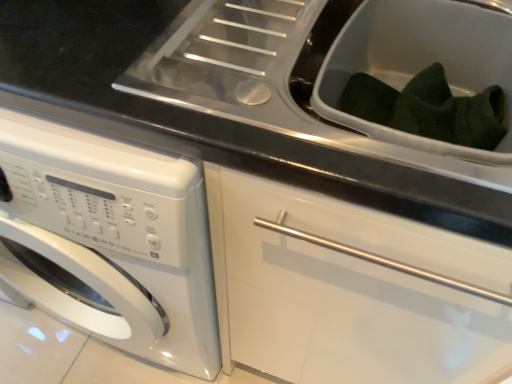
I want to click on dark green fabric at upper right, which is the first sink from back to front, so click(422, 62).

Where is `white plastic sink at center, acting as the 1th sink starting from the front`? white plastic sink at center, acting as the 1th sink starting from the front is located at coordinates (276, 84).

Between white plastic sink at center, acting as the 1th sink starting from the front, and dark green fabric at upper right, which is the second sink in front-to-back order, which one appears on the left side from the viewer's perspective?

white plastic sink at center, acting as the 1th sink starting from the front, is more to the left.

Is white plastic sink at center, marked as the second sink in a back-to-front arrangement, oriented away from dark green fabric at upper right, which is the second sink in front-to-back order?

Absolutely, white plastic sink at center, marked as the second sink in a back-to-front arrangement, is directed away from dark green fabric at upper right, which is the second sink in front-to-back order.

In the scene shown: Considering the sizes of objects white plastic sink at center, marked as the second sink in a back-to-front arrangement, and dark green fabric at upper right, which is the second sink in front-to-back order, in the image provided, who is thinner, white plastic sink at center, marked as the second sink in a back-to-front arrangement, or dark green fabric at upper right, which is the second sink in front-to-back order,?

Thinner between the two is dark green fabric at upper right, which is the second sink in front-to-back order.

Is the position of white plastic sink at center, marked as the second sink in a back-to-front arrangement, less distant than that of dark green fabric at upper right, which is the first sink from back to front?

Yes, it is in front of dark green fabric at upper right, which is the first sink from back to front.

Is white glossy washing machine at left at the back of dark green fabric at upper right, which is the first sink from back to front?

No, dark green fabric at upper right, which is the first sink from back to front,'s orientation is not away from white glossy washing machine at left.

In order to click on washing machine below the dark green fabric at upper right, which is the second sink in front-to-back order (from a real-world perspective) in this screenshot , I will do `click(109, 241)`.

From the image's perspective, does dark green fabric at upper right, which is the first sink from back to front, appear lower than white glossy washing machine at left?

Actually, dark green fabric at upper right, which is the first sink from back to front, appears above white glossy washing machine at left in the image.

Is dark green fabric at upper right, which is the second sink in front-to-back order, smaller than white glossy washing machine at left?

Yes.

Considering the sizes of objects white glossy washing machine at left and white plastic sink at center, marked as the second sink in a back-to-front arrangement, in the image provided, who is smaller, white glossy washing machine at left or white plastic sink at center, marked as the second sink in a back-to-front arrangement,?

Smaller between the two is white plastic sink at center, marked as the second sink in a back-to-front arrangement.

From the image's perspective, which is above, white glossy washing machine at left or white plastic sink at center, acting as the 1th sink starting from the front?

white plastic sink at center, acting as the 1th sink starting from the front, appears higher in the image.

Between white glossy washing machine at left and white plastic sink at center, marked as the second sink in a back-to-front arrangement, which one appears on the left side from the viewer's perspective?

white glossy washing machine at left is more to the left.

Between point (110, 252) and point (376, 155), which one is positioned behind?

The point (110, 252) is farther.

How different are the orientations of dark green fabric at upper right, which is the first sink from back to front, and white plastic sink at center, acting as the 1th sink starting from the front, in degrees?

The facing directions of dark green fabric at upper right, which is the first sink from back to front, and white plastic sink at center, acting as the 1th sink starting from the front, are 0.639 degrees apart.

Does dark green fabric at upper right, which is the second sink in front-to-back order, have a lesser height compared to white plastic sink at center, marked as the second sink in a back-to-front arrangement?

Yes.

From the image's perspective, relative to white plastic sink at center, acting as the 1th sink starting from the front, is dark green fabric at upper right, which is the first sink from back to front, above or below?

dark green fabric at upper right, which is the first sink from back to front, is below white plastic sink at center, acting as the 1th sink starting from the front.

From a real-world perspective, is dark green fabric at upper right, which is the first sink from back to front, on top of white plastic sink at center, acting as the 1th sink starting from the front?

No, from a real-world perspective, dark green fabric at upper right, which is the first sink from back to front, is not over white plastic sink at center, acting as the 1th sink starting from the front

Is white glossy washing machine at left spatially inside dark green fabric at upper right, which is the second sink in front-to-back order, or outside of it?

white glossy washing machine at left cannot be found inside dark green fabric at upper right, which is the second sink in front-to-back order.

Considering the positions of objects white glossy washing machine at left and dark green fabric at upper right, which is the first sink from back to front, in the image provided, who is more to the right, white glossy washing machine at left or dark green fabric at upper right, which is the first sink from back to front,?

Positioned to the right is dark green fabric at upper right, which is the first sink from back to front.

Does point (51, 147) appear closer or farther from the camera than point (474, 42)?

Point (51, 147) is closer to the camera than point (474, 42).

Can you tell me how much white glossy washing machine at left and dark green fabric at upper right, which is the second sink in front-to-back order, differ in facing direction?

white glossy washing machine at left and dark green fabric at upper right, which is the second sink in front-to-back order, are facing 2.2 degrees away from each other.

Considering the points (483, 182) and (203, 301), which point is in front, point (483, 182) or point (203, 301)?

Positioned in front is point (483, 182).

Is white glossy washing machine at left a part of white plastic sink at center, marked as the second sink in a back-to-front arrangement?

Actually, white glossy washing machine at left is outside white plastic sink at center, marked as the second sink in a back-to-front arrangement.

Consider the image. Is white plastic sink at center, acting as the 1th sink starting from the front, to the left of white glossy washing machine at left from the viewer's perspective?

No.

Does white plastic sink at center, acting as the 1th sink starting from the front, have a greater height compared to white glossy washing machine at left?

No, white plastic sink at center, acting as the 1th sink starting from the front, is not taller than white glossy washing machine at left.

Identify the location of sink behind the white plastic sink at center, acting as the 1th sink starting from the front. [422, 62].

Find the location of a particular element. The image size is (512, 384). washing machine below the dark green fabric at upper right, which is the second sink in front-to-back order (from a real-world perspective) is located at coordinates (109, 241).

Consider the image. Which object lies nearer to the anchor point white glossy washing machine at left, white plastic sink at center, marked as the second sink in a back-to-front arrangement, or dark green fabric at upper right, which is the first sink from back to front?

white plastic sink at center, marked as the second sink in a back-to-front arrangement, is positioned closer to the anchor white glossy washing machine at left.

Which object lies nearer to the anchor point white plastic sink at center, acting as the 1th sink starting from the front, dark green fabric at upper right, which is the second sink in front-to-back order, or white glossy washing machine at left?

Based on the image, dark green fabric at upper right, which is the second sink in front-to-back order, appears to be nearer to white plastic sink at center, acting as the 1th sink starting from the front.

Considering their positions, is white glossy washing machine at left positioned closer to white plastic sink at center, acting as the 1th sink starting from the front, than dark green fabric at upper right, which is the second sink in front-to-back order?

dark green fabric at upper right, which is the second sink in front-to-back order, is positioned closer to the anchor white plastic sink at center, acting as the 1th sink starting from the front.

Based on their spatial positions, is white plastic sink at center, marked as the second sink in a back-to-front arrangement, or white glossy washing machine at left closer to dark green fabric at upper right, which is the first sink from back to front?

The object closer to dark green fabric at upper right, which is the first sink from back to front, is white plastic sink at center, marked as the second sink in a back-to-front arrangement.

Looking at this image, based on their spatial positions, is white glossy washing machine at left or white plastic sink at center, acting as the 1th sink starting from the front, closer to dark green fabric at upper right, which is the first sink from back to front?

Based on the image, white plastic sink at center, acting as the 1th sink starting from the front, appears to be nearer to dark green fabric at upper right, which is the first sink from back to front.

When comparing their distances from white glossy washing machine at left, does dark green fabric at upper right, which is the first sink from back to front, or white plastic sink at center, acting as the 1th sink starting from the front, seem closer?

Based on the image, white plastic sink at center, acting as the 1th sink starting from the front, appears to be nearer to white glossy washing machine at left.

I want to click on sink located between white glossy washing machine at left and dark green fabric at upper right, which is the second sink in front-to-back order, in the left-right direction, so click(x=276, y=84).